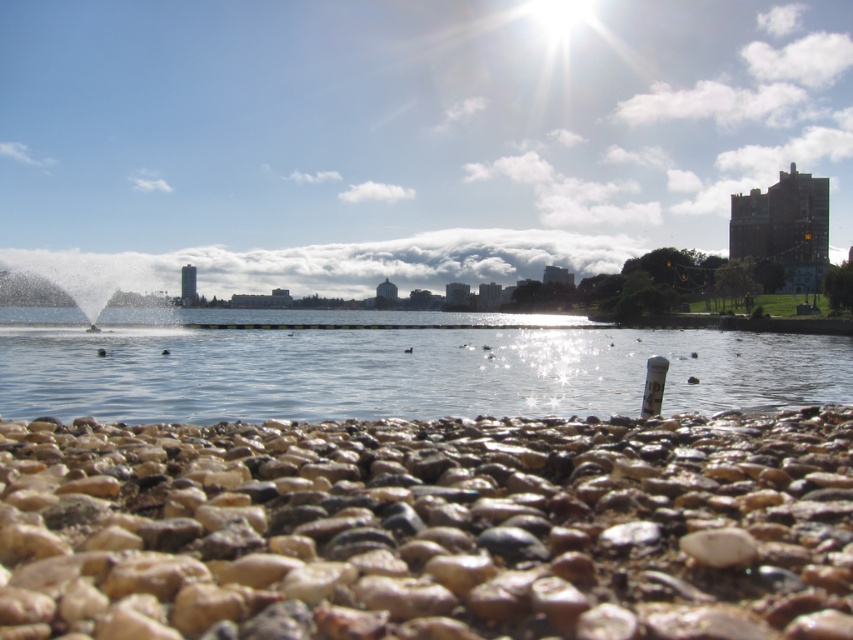
Question: Is brown pebbles at lower center bigger than clear water at center?

Choices:
 (A) no
 (B) yes

Answer: (A)

Question: Among these objects, which one is farthest from the camera?

Choices:
 (A) clear water at center
 (B) brown pebbles at lower center

Answer: (A)

Question: Among these objects, which one is farthest from the camera?

Choices:
 (A) clear water at center
 (B) brown pebbles at lower center

Answer: (A)

Question: Among these points, which one is farthest from the camera?

Choices:
 (A) (585, 355)
 (B) (73, 508)

Answer: (A)

Question: Is brown pebbles at lower center wider than clear water at center?

Choices:
 (A) yes
 (B) no

Answer: (B)

Question: In this image, where is brown pebbles at lower center located relative to clear water at center?

Choices:
 (A) left
 (B) right

Answer: (B)